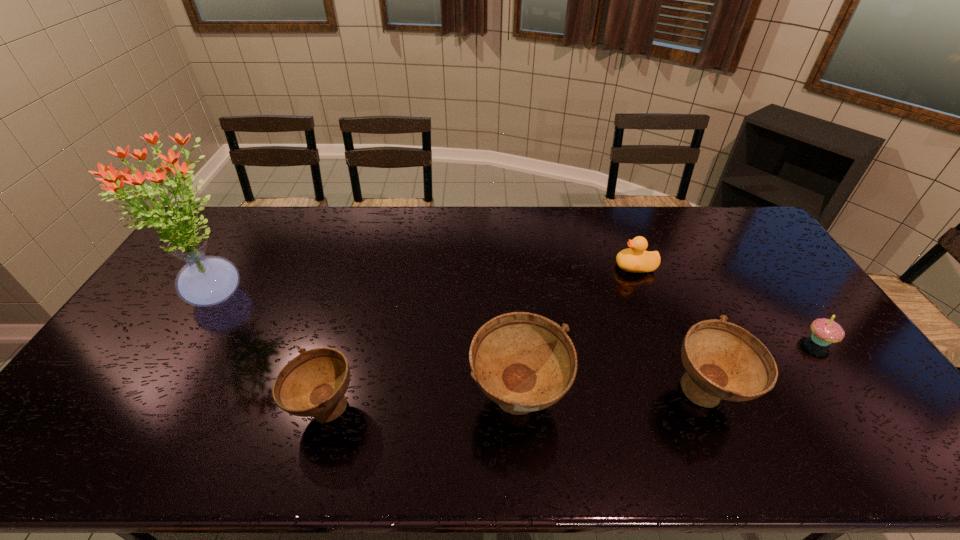
With all soup bowls evenly spaced, where should an extra soup bowl be placed on the left to continue the pattern? Please point out a vacant space. Please provide its 2D coordinates. Your answer should be formatted as a tuple, i.e. [(x, y)], where the tuple contains the x and y coordinates of a point satisfying the conditions above.

[(125, 417)]